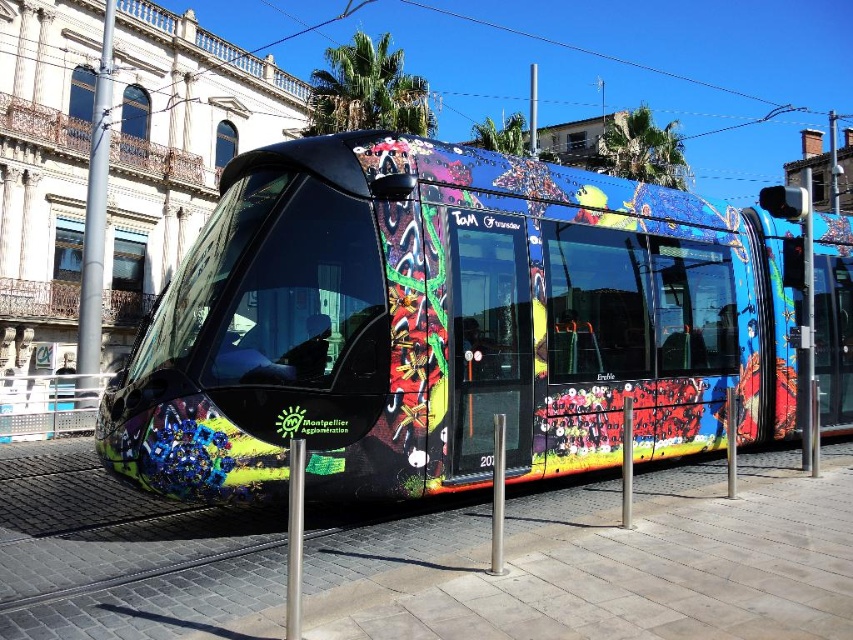
You are a passenger waiting at the Montpellier tram station. You see the multicolored graffiti train at center and the silver metallic pole at left. Which object is closer to you as you face the tram?

The silver metallic pole at left is closer to you because the multicolored graffiti train at center is positioned under it, meaning the pole is in front of the train.

You are standing at the station and looking at the tram. You see two points marked on the tram. The first point is at coordinate point(x=839, y=298) and the second point is at coordinate point(x=100, y=301). Which point is closer to you?

Point(x=839, y=298) is in front of point(x=100, y=301), so the point closer to you is point(x=839, y=298).

You are a passenger waiting at the Montpellier tram station. You see the multicolored graffiti train at center and the silver metallic pole at left. Which object is closer to you as you face the tram?

The multicolored graffiti train at center is closer to you because it is in front of the silver metallic pole at left.